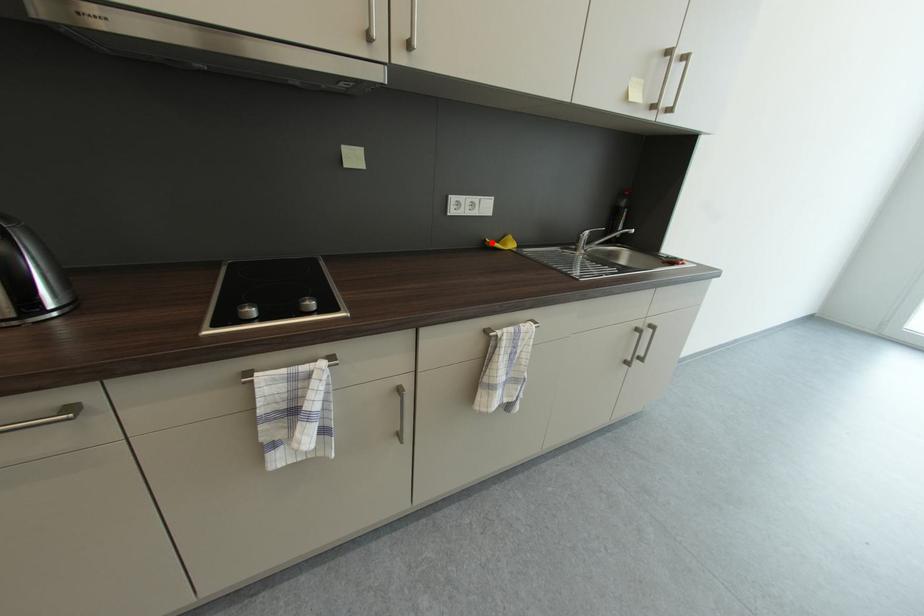
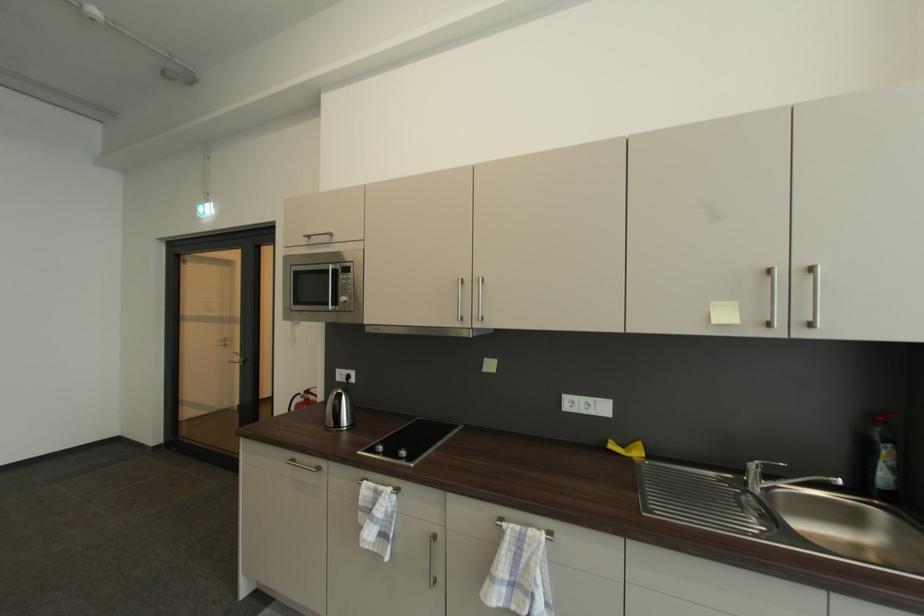
Question: I am providing you with two images of the same scene from different viewpoints. A red point is shown in image1. For the corresponding object point in image2, is it positioned nearer or farther from the camera?

Choices:
 (A) Nearer
 (B) Farther

Answer: (B)